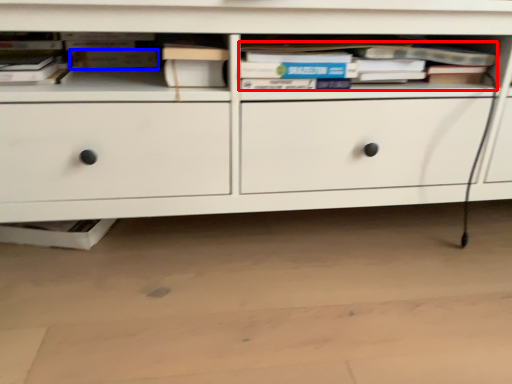
Question: Which object appears closest to the camera in this image, book (highlighted by a red box) or paperback book (highlighted by a blue box)?

Choices:
 (A) book
 (B) paperback book

Answer: (A)